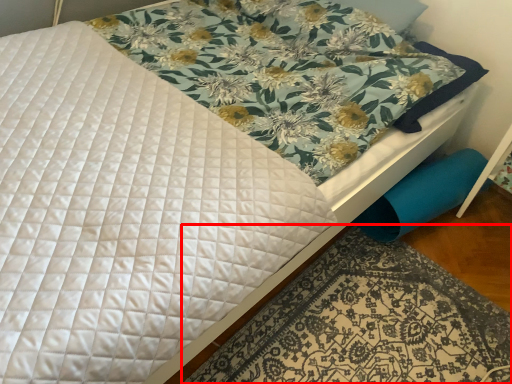
Question: Considering the relative positions of mat (annotated by the red box) and swivel chair in the image provided, where is mat (annotated by the red box) located with respect to the staircase?

Choices:
 (A) right
 (B) left

Answer: (B)